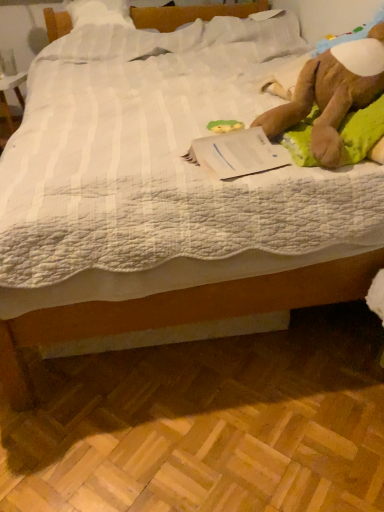
Question: Does brown plush toy at upper right have a greater width compared to green rubber duck at center?

Choices:
 (A) yes
 (B) no

Answer: (A)

Question: Is green rubber duck at center surrounded by brown plush toy at upper right?

Choices:
 (A) yes
 (B) no

Answer: (B)

Question: Considering the relative positions of brown plush toy at upper right and green rubber duck at center in the image provided, is brown plush toy at upper right to the right of green rubber duck at center from the viewer's perspective?

Choices:
 (A) yes
 (B) no

Answer: (A)

Question: From the image's perspective, is brown plush toy at upper right below green rubber duck at center?

Choices:
 (A) no
 (B) yes

Answer: (A)

Question: Is brown plush toy at upper right positioned beyond the bounds of green rubber duck at center?

Choices:
 (A) no
 (B) yes

Answer: (B)

Question: Considering the positions of white paper at upper right and brown plush toy at upper right in the image, is white paper at upper right bigger or smaller than brown plush toy at upper right?

Choices:
 (A) small
 (B) big

Answer: (A)

Question: Is point (223, 179) closer or farther from the camera than point (336, 164)?

Choices:
 (A) closer
 (B) farther

Answer: (A)

Question: Choose the correct answer: Is white paper at upper right inside brown plush toy at upper right or outside it?

Choices:
 (A) outside
 (B) inside

Answer: (A)

Question: Relative to brown plush toy at upper right, is white paper at upper right in front or behind?

Choices:
 (A) front
 (B) behind

Answer: (B)

Question: Is brown plush toy at upper right spatially inside white paper at upper right, or outside of it?

Choices:
 (A) outside
 (B) inside

Answer: (A)

Question: Relative to white paper at upper right, is brown plush toy at upper right in front or behind?

Choices:
 (A) front
 (B) behind

Answer: (A)

Question: Is point (334, 102) closer or farther from the camera than point (258, 143)?

Choices:
 (A) closer
 (B) farther

Answer: (A)

Question: Is brown plush toy at upper right to the left or to the right of white paper at upper right in the image?

Choices:
 (A) right
 (B) left

Answer: (A)

Question: Is point (327, 54) positioned closer to the camera than point (243, 125)?

Choices:
 (A) closer
 (B) farther

Answer: (A)

Question: Considering the relative positions of brown plush toy at upper right and green rubber duck at center in the image provided, is brown plush toy at upper right to the left or to the right of green rubber duck at center?

Choices:
 (A) left
 (B) right

Answer: (B)